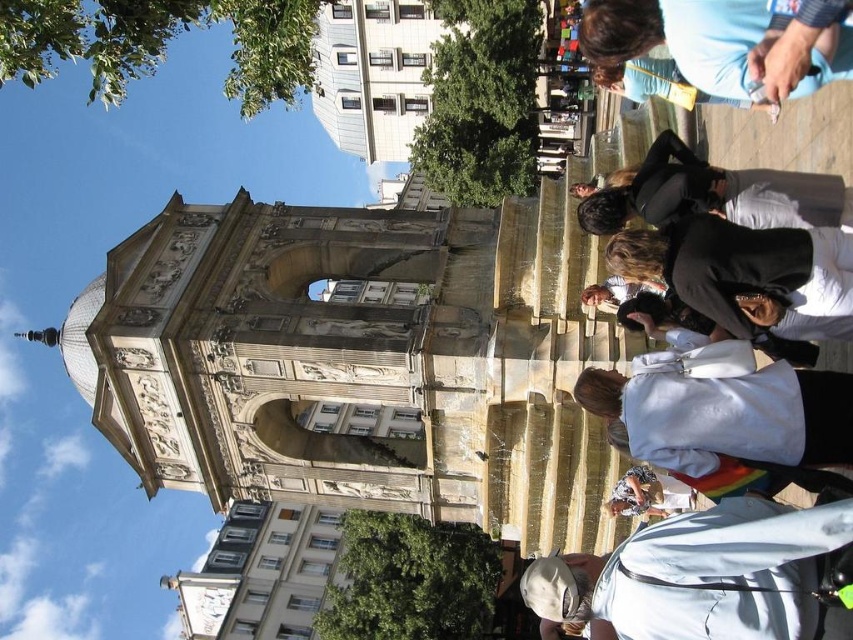
Question: Can you confirm if black matte jacket at center is positioned to the right of denim jacket at lower right?

Choices:
 (A) no
 (B) yes

Answer: (A)

Question: Estimate the real-world distances between objects in this image. Which object is farther from the blue fabric shirt at upper right?

Choices:
 (A) white cotton shirt at lower right
 (B) denim jacket at lower right
 (C) stone archway at center
 (D) black leather jacket at upper right

Answer: (C)

Question: Can you confirm if stone archway at center is positioned above black leather jacket at upper right?

Choices:
 (A) no
 (B) yes

Answer: (A)

Question: Which of the following is the closest to the observer?

Choices:
 (A) blue fabric shirt at upper right
 (B) black matte jacket at center

Answer: (A)

Question: Which point appears farthest from the camera in this image?

Choices:
 (A) (780, 529)
 (B) (793, 420)

Answer: (B)

Question: Does stone archway at center have a smaller size compared to black leather jacket at upper right?

Choices:
 (A) no
 (B) yes

Answer: (A)